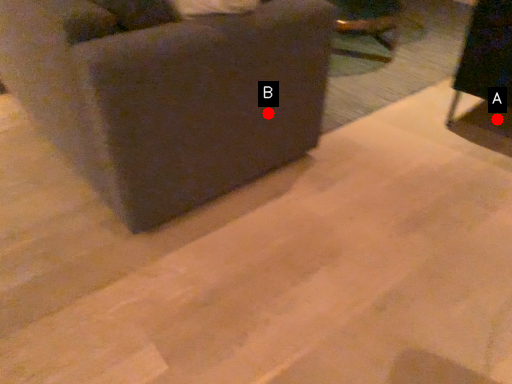
Question: Two points are circled on the image, labeled by A and B beside each circle. Among these points, which one is nearest to the camera?

Choices:
 (A) A is closer
 (B) B is closer

Answer: (B)